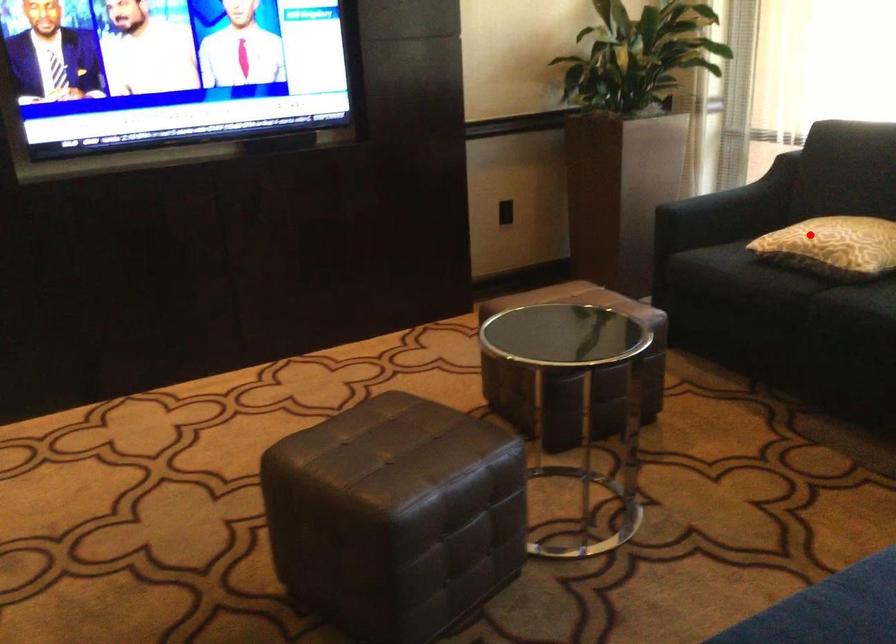
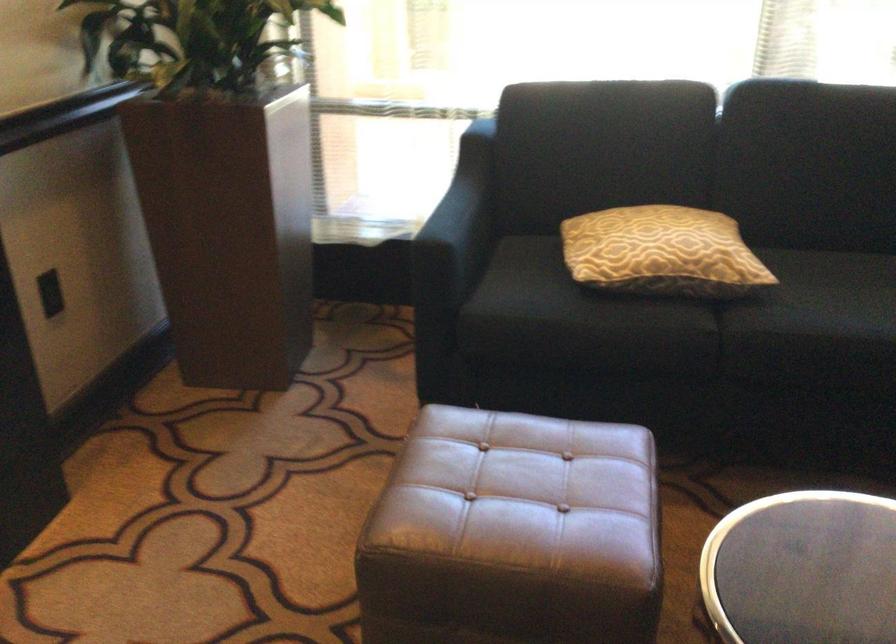
Question: I am providing you with two images of the same scene from different viewpoints. Image1 has a red point marked. In image2, the corresponding 3D location appears at what relative position? Reply with the corresponding letter.

Choices:
 (A) Closer
 (B) Farther

Answer: (A)